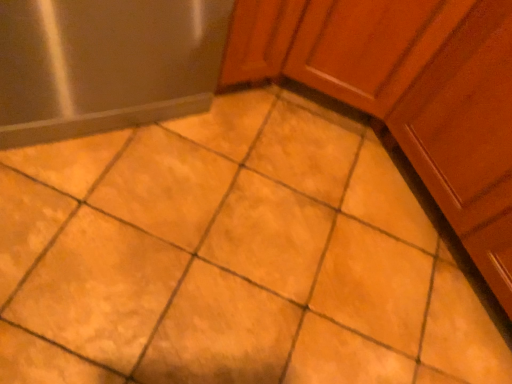
Question: Considering the relative sizes of satin silver refrigerator at left and matte wood cabinet at upper right in the image provided, is satin silver refrigerator at left shorter than matte wood cabinet at upper right?

Choices:
 (A) yes
 (B) no

Answer: (A)

Question: Is satin silver refrigerator at left looking in the opposite direction of matte wood cabinet at upper right?

Choices:
 (A) no
 (B) yes

Answer: (A)

Question: Is matte wood cabinet at upper right completely or partially inside satin silver refrigerator at left?

Choices:
 (A) no
 (B) yes

Answer: (A)

Question: Is satin silver refrigerator at left to the right of matte wood cabinet at upper right from the viewer's perspective?

Choices:
 (A) no
 (B) yes

Answer: (A)

Question: Can you confirm if satin silver refrigerator at left is wider than matte wood cabinet at upper right?

Choices:
 (A) yes
 (B) no

Answer: (B)

Question: From a real-world perspective, is satin silver refrigerator at left on top of matte wood cabinet at upper right?

Choices:
 (A) no
 (B) yes

Answer: (A)

Question: From a real-world perspective, is matte wood cabinet at upper right beneath satin silver refrigerator at left?

Choices:
 (A) yes
 (B) no

Answer: (B)

Question: Does matte wood cabinet at upper right lie in front of satin silver refrigerator at left?

Choices:
 (A) yes
 (B) no

Answer: (A)

Question: Are matte wood cabinet at upper right and satin silver refrigerator at left making contact?

Choices:
 (A) yes
 (B) no

Answer: (B)

Question: Does matte wood cabinet at upper right have a lesser height compared to satin silver refrigerator at left?

Choices:
 (A) no
 (B) yes

Answer: (A)

Question: Is matte wood cabinet at upper right oriented towards satin silver refrigerator at left?

Choices:
 (A) yes
 (B) no

Answer: (A)

Question: Is matte wood cabinet at upper right smaller than satin silver refrigerator at left?

Choices:
 (A) no
 (B) yes

Answer: (A)

Question: Considering the positions of satin silver refrigerator at left and matte wood cabinet at upper right in the image, is satin silver refrigerator at left taller or shorter than matte wood cabinet at upper right?

Choices:
 (A) tall
 (B) short

Answer: (B)